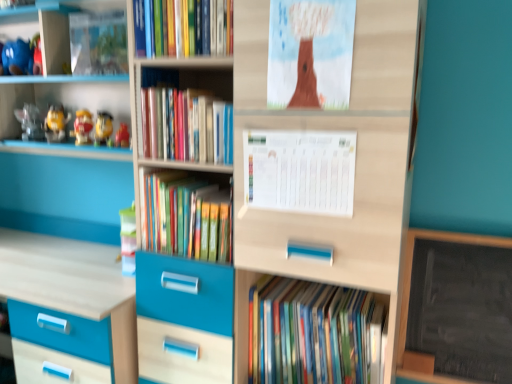
Question: Considering the relative sizes of hardcover books at center, the third book viewed from the top, and hardcover books at upper center, acting as the 4th book starting from the bottom, in the image provided, is hardcover books at center, the third book viewed from the top, bigger than hardcover books at upper center, acting as the 4th book starting from the bottom,?

Choices:
 (A) no
 (B) yes

Answer: (B)

Question: Does hardcover books at center, marked as the 2th book in a bottom-to-top arrangement, have a lesser width compared to hardcover books at upper center, the first book when ordered from top to bottom?

Choices:
 (A) no
 (B) yes

Answer: (B)

Question: Does hardcover books at center, marked as the 2th book in a bottom-to-top arrangement, turn towards hardcover books at upper center, the first book when ordered from top to bottom?

Choices:
 (A) no
 (B) yes

Answer: (A)

Question: Is hardcover books at center, marked as the 2th book in a bottom-to-top arrangement, wider than hardcover books at upper center, acting as the 4th book starting from the bottom?

Choices:
 (A) yes
 (B) no

Answer: (B)

Question: Considering the relative positions of hardcover books at center, marked as the 2th book in a bottom-to-top arrangement, and hardcover books at upper center, acting as the 4th book starting from the bottom, in the image provided, is hardcover books at center, marked as the 2th book in a bottom-to-top arrangement, to the right of hardcover books at upper center, acting as the 4th book starting from the bottom, from the viewer's perspective?

Choices:
 (A) no
 (B) yes

Answer: (B)

Question: Is hardcover books at center, marked as the 2th book in a bottom-to-top arrangement, far away from hardcover books at upper center, the first book when ordered from top to bottom?

Choices:
 (A) no
 (B) yes

Answer: (A)

Question: Is hardcover books at center, the third book viewed from the top, bigger than brown paper at upper center, positioned as the 2th paperback book in bottom-to-top order?

Choices:
 (A) no
 (B) yes

Answer: (B)

Question: Does hardcover books at center, marked as the 2th book in a bottom-to-top arrangement, contain brown paper at upper center, arranged as the 1th paperback book when viewed from the top?

Choices:
 (A) yes
 (B) no

Answer: (B)

Question: Is hardcover books at center, the third book viewed from the top, not near brown paper at upper center, arranged as the 1th paperback book when viewed from the top?

Choices:
 (A) no
 (B) yes

Answer: (A)

Question: Is hardcover books at center, marked as the 2th book in a bottom-to-top arrangement, looking in the opposite direction of brown paper at upper center, positioned as the 2th paperback book in bottom-to-top order?

Choices:
 (A) no
 (B) yes

Answer: (A)

Question: Is hardcover books at center, the third book viewed from the top, in front of brown paper at upper center, positioned as the 2th paperback book in bottom-to-top order?

Choices:
 (A) yes
 (B) no

Answer: (B)

Question: From the image's perspective, is hardcover books at center, marked as the 2th book in a bottom-to-top arrangement, located beneath brown paper at upper center, positioned as the 2th paperback book in bottom-to-top order?

Choices:
 (A) yes
 (B) no

Answer: (A)

Question: Are matte yellow toy at left, the 1th toy from the right, and brown paper at upper center, positioned as the 2th paperback book in bottom-to-top order, far apart?

Choices:
 (A) no
 (B) yes

Answer: (A)